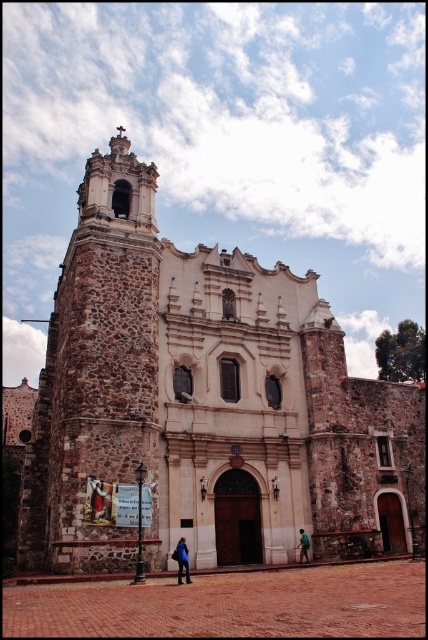
Does blue denim jacket at lower center have a lesser width compared to green fabric person at center?

In fact, blue denim jacket at lower center might be wider than green fabric person at center.

Does blue denim jacket at lower center lie behind green fabric person at center?

No, blue denim jacket at lower center is closer to the viewer.

This screenshot has width=428, height=640. I want to click on blue denim jacket at lower center, so click(x=98, y=500).

Between stone church at center and blue fabric at lower center, which one has less height?

With less height is blue fabric at lower center.

This screenshot has height=640, width=428. Describe the element at coordinates (204, 404) in the screenshot. I see `stone church at center` at that location.

Find the location of a particular element. This screenshot has width=428, height=640. stone church at center is located at coordinates (204, 404).

Who is positioned more to the left, blue fabric at lower center or green fabric person at center?

blue fabric at lower center

Which is below, blue fabric at lower center or green fabric person at center?

green fabric person at center is below.

Locate an element on the screen. The width and height of the screenshot is (428, 640). blue fabric at lower center is located at coordinates (183, 561).